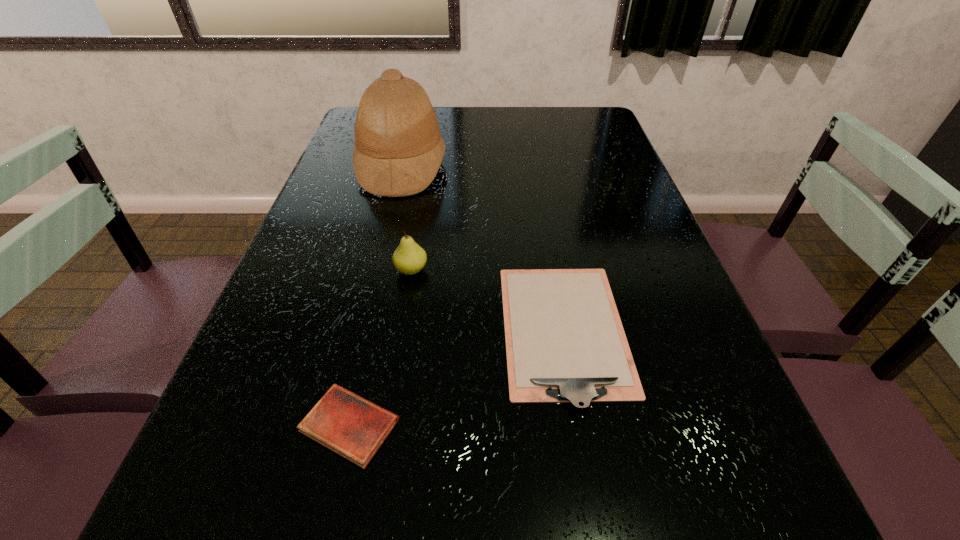
The height and width of the screenshot is (540, 960). I want to click on vacant space that satisfies the following two spatial constraints: 1. on the front-facing side of the tallest object; 2. on the right side of the diary, so click(338, 425).

Where is `free spot that satisfies the following two spatial constraints: 1. on the front-facing side of the shortest object; 2. on the right side of the farthest object`? Image resolution: width=960 pixels, height=540 pixels. free spot that satisfies the following two spatial constraints: 1. on the front-facing side of the shortest object; 2. on the right side of the farthest object is located at coordinates (338, 425).

Locate an element on the screen. The height and width of the screenshot is (540, 960). vacant space that satisfies the following two spatial constraints: 1. on the front side of the pear; 2. on the left side of the clipboard is located at coordinates (401, 332).

I want to click on blank area in the image that satisfies the following two spatial constraints: 1. on the front-facing side of the farthest object; 2. on the right side of the rightmost object, so click(x=361, y=332).

At what (x,y) coordinates should I click in order to perform the action: click on free space that satisfies the following two spatial constraints: 1. on the back side of the shortest object; 2. on the front-facing side of the tallest object. Please return your answer as a coordinate pair (x, y). The height and width of the screenshot is (540, 960). Looking at the image, I should click on (408, 166).

Identify the location of free region that satisfies the following two spatial constraints: 1. on the front-facing side of the shortest object; 2. on the left side of the tallest object. This screenshot has width=960, height=540. (338, 425).

Where is `free space that satisfies the following two spatial constraints: 1. on the back side of the shortest object; 2. on the left side of the rightmost object`? The image size is (960, 540). free space that satisfies the following two spatial constraints: 1. on the back side of the shortest object; 2. on the left side of the rightmost object is located at coordinates (371, 332).